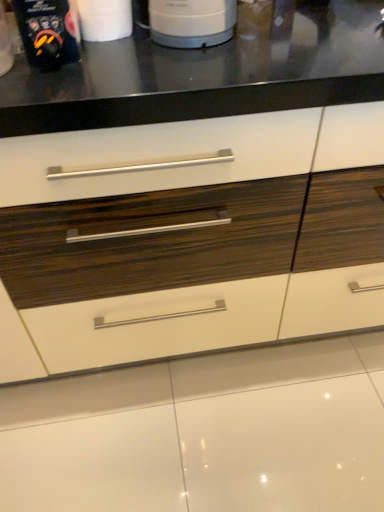
Question: Does white glossy drawer at center have a greater height compared to matte black coffee maker at upper left?

Choices:
 (A) yes
 (B) no

Answer: (A)

Question: Does white glossy drawer at center have a lesser width compared to matte black coffee maker at upper left?

Choices:
 (A) yes
 (B) no

Answer: (B)

Question: Is white glossy drawer at center located outside matte black coffee maker at upper left?

Choices:
 (A) no
 (B) yes

Answer: (B)

Question: From the image's perspective, is white glossy drawer at center beneath matte black coffee maker at upper left?

Choices:
 (A) yes
 (B) no

Answer: (A)

Question: Is white glossy drawer at center turned away from matte black coffee maker at upper left?

Choices:
 (A) yes
 (B) no

Answer: (B)

Question: Do you think white glossy drawer at center is within white matte paper towel at upper left, or outside of it?

Choices:
 (A) inside
 (B) outside

Answer: (B)

Question: Does point (135, 175) appear closer or farther from the camera than point (99, 12)?

Choices:
 (A) closer
 (B) farther

Answer: (A)

Question: From a real-world perspective, is white glossy drawer at center positioned above or below white matte paper towel at upper left?

Choices:
 (A) above
 (B) below

Answer: (B)

Question: In terms of height, does white glossy drawer at center look taller or shorter compared to white matte paper towel at upper left?

Choices:
 (A) short
 (B) tall

Answer: (B)

Question: Is matte black coffee maker at upper left in front of or behind white matte paper towel at upper left in the image?

Choices:
 (A) front
 (B) behind

Answer: (A)

Question: From a real-world perspective, is matte black coffee maker at upper left physically located above or below white matte paper towel at upper left?

Choices:
 (A) below
 (B) above

Answer: (B)

Question: From the image's perspective, is matte black coffee maker at upper left located above or below white matte paper towel at upper left?

Choices:
 (A) above
 (B) below

Answer: (B)

Question: In terms of size, does matte black coffee maker at upper left appear bigger or smaller than white matte paper towel at upper left?

Choices:
 (A) big
 (B) small

Answer: (A)

Question: Is white matte paper towel at upper left to the left or to the right of matte black coffee maker at upper left in the image?

Choices:
 (A) right
 (B) left

Answer: (A)

Question: Would you say white matte paper towel at upper left is inside or outside matte black coffee maker at upper left?

Choices:
 (A) inside
 (B) outside

Answer: (B)